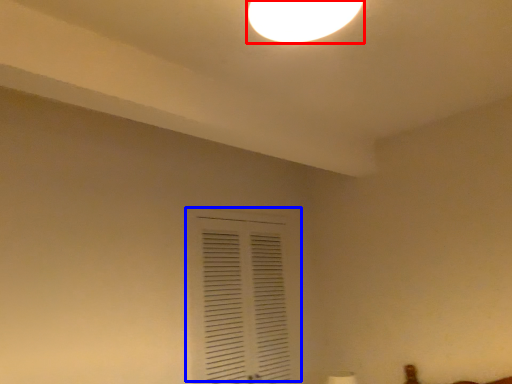
Question: Among these objects, which one is nearest to the camera, lamp (highlighted by a red box) or window (highlighted by a blue box)?

Choices:
 (A) lamp
 (B) window

Answer: (A)